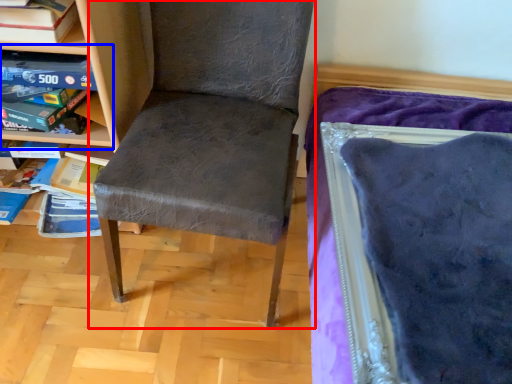
Question: Which object appears closest to the camera in this image, chair (highlighted by a red box) or shelf (highlighted by a blue box)?

Choices:
 (A) chair
 (B) shelf

Answer: (A)